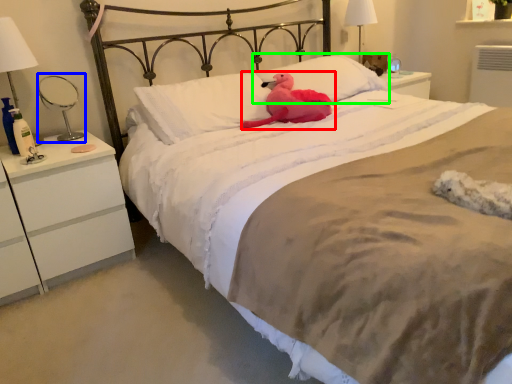
Question: Which object is the farthest from animal (highlighted by a red box)? Choose among these: table lamp (highlighted by a blue box) or pillow (highlighted by a green box).

Choices:
 (A) table lamp
 (B) pillow

Answer: (A)